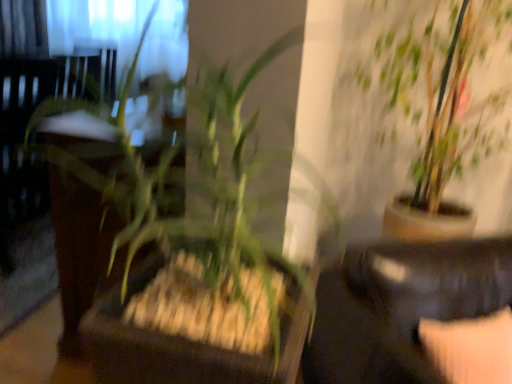
Question: From a real-world perspective, is black leather couch at lower right located beneath velvet beige pillow at lower right?

Choices:
 (A) yes
 (B) no

Answer: (A)

Question: Is black leather couch at lower right wider than velvet beige pillow at lower right?

Choices:
 (A) no
 (B) yes

Answer: (B)

Question: Is black leather couch at lower right placed right next to velvet beige pillow at lower right?

Choices:
 (A) no
 (B) yes

Answer: (A)

Question: Does black leather couch at lower right have a greater height compared to velvet beige pillow at lower right?

Choices:
 (A) no
 (B) yes

Answer: (B)

Question: Does black leather couch at lower right appear on the right side of velvet beige pillow at lower right?

Choices:
 (A) no
 (B) yes

Answer: (B)

Question: Is black leather couch at lower right at the left side of velvet beige pillow at lower right?

Choices:
 (A) no
 (B) yes

Answer: (A)

Question: From the image's perspective, is green leafy plant at center, the 2th houseplant viewed from the right, on velvet beige pillow at lower right?

Choices:
 (A) yes
 (B) no

Answer: (A)

Question: Considering the relative sizes of green leafy plant at center, the 2th houseplant viewed from the right, and velvet beige pillow at lower right in the image provided, is green leafy plant at center, the 2th houseplant viewed from the right, thinner than velvet beige pillow at lower right?

Choices:
 (A) yes
 (B) no

Answer: (B)

Question: Considering the relative sizes of green leafy plant at center, the 1th houseplant positioned from the front, and velvet beige pillow at lower right in the image provided, is green leafy plant at center, the 1th houseplant positioned from the front, shorter than velvet beige pillow at lower right?

Choices:
 (A) yes
 (B) no

Answer: (B)

Question: Is green leafy plant at center, positioned as the 1th houseplant in left-to-right order, further to camera compared to velvet beige pillow at lower right?

Choices:
 (A) yes
 (B) no

Answer: (B)

Question: From the image's perspective, is green leafy plant at center, the 2th houseplant viewed from the right, below velvet beige pillow at lower right?

Choices:
 (A) no
 (B) yes

Answer: (A)

Question: Does green leafy plant at center, the 1th houseplant positioned from the front, appear on the right side of velvet beige pillow at lower right?

Choices:
 (A) no
 (B) yes

Answer: (A)

Question: From a real-world perspective, is green leafy plant at center, which appears as the 2th houseplant when viewed from the back, on black leather couch at lower right?

Choices:
 (A) yes
 (B) no

Answer: (A)